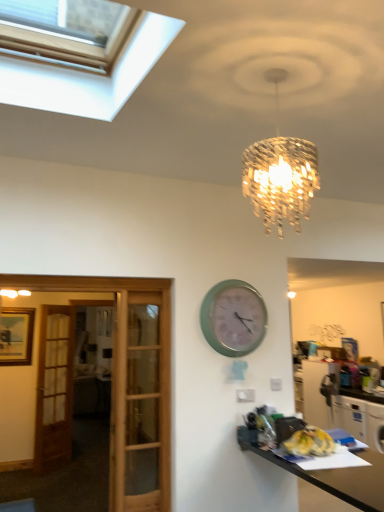
What is the approximate height of brown wooden door at left?

The height of brown wooden door at left is 1.86 meters.

Measure the distance between white glossy cabinet at lower right and camera.

They are 5.34 meters apart.

Locate an element on the screen. The width and height of the screenshot is (384, 512). green matte wall clock at center is located at coordinates [233, 318].

Where is `brown wooden door at left`? brown wooden door at left is located at coordinates (54, 388).

From the image's perspective, is brown wooden door at left over black glossy desk at lower right?

Incorrect, from the image's perspective, brown wooden door at left is lower than black glossy desk at lower right.

Considering the points (65, 454) and (354, 484), which point is in front, point (65, 454) or point (354, 484)?

The point (354, 484) is closer.

Relative to black glossy desk at lower right, is brown wooden door at left in front or behind?

Clearly, brown wooden door at left is behind black glossy desk at lower right.

From a real-world perspective, who is located higher, brown wooden door at left or black glossy desk at lower right?

brown wooden door at left, from a real-world perspective.

Is green matte wall clock at center spatially inside white glossy cabinet at lower right, or outside of it?

green matte wall clock at center is not inside white glossy cabinet at lower right, it's outside.

Is green matte wall clock at center positioned with its back to white glossy cabinet at lower right?

No, green matte wall clock at center is not facing away from white glossy cabinet at lower right.

Is green matte wall clock at center taller than white glossy cabinet at lower right?

In fact, green matte wall clock at center may be shorter than white glossy cabinet at lower right.

Is green matte wall clock at center bigger or smaller than white glossy cabinet at lower right?

Considering their sizes, green matte wall clock at center takes up less space than white glossy cabinet at lower right.

Does point (348, 429) appear closer or farther from the camera than point (350, 493)?

Point (348, 429) is positioned farther from the camera compared to point (350, 493).

How far apart are white glossy cabinet at lower right and black glossy desk at lower right?

3.54 meters.

How many degrees apart are the facing directions of white glossy cabinet at lower right and black glossy desk at lower right?

They differ by 3.05 degrees in their facing directions.

Considering the sizes of objects white glossy cabinet at lower right and black glossy desk at lower right in the image provided, who is smaller, white glossy cabinet at lower right or black glossy desk at lower right?

white glossy cabinet at lower right is smaller.

Is black glossy desk at lower right oriented away from white glossy cabinet at lower right?

That's not correct — black glossy desk at lower right is not looking away from white glossy cabinet at lower right.

From a real-world perspective, is black glossy desk at lower right over white glossy cabinet at lower right?

Incorrect, from a real-world perspective, black glossy desk at lower right is lower than white glossy cabinet at lower right.

Which object is positioned more to the right, black glossy desk at lower right or white glossy cabinet at lower right?

white glossy cabinet at lower right is more to the right.

Is there a large distance between black glossy desk at lower right and white glossy cabinet at lower right?

Yes, black glossy desk at lower right and white glossy cabinet at lower right are located far from each other.

Could you tell me if green matte wall clock at center is turned towards brown wooden door at left?

No, green matte wall clock at center is not oriented towards brown wooden door at left.

Measure the distance from green matte wall clock at center to brown wooden door at left.

green matte wall clock at center is 8.26 feet away from brown wooden door at left.

Would you consider green matte wall clock at center to be distant from brown wooden door at left?

Yes, green matte wall clock at center is far from brown wooden door at left.

Which is behind, point (241, 330) or point (63, 322)?

The point (63, 322) is more distant.

Is black glossy desk at lower right positioned beyond the bounds of brown wooden door at left?

Yes.

Can you confirm if black glossy desk at lower right is taller than brown wooden door at left?

No, black glossy desk at lower right is not taller than brown wooden door at left.

Does point (304, 475) come farther from viewer compared to point (62, 447)?

No, (304, 475) is in front of (62, 447).

Is black glossy desk at lower right aimed at brown wooden door at left?

No.

Which is less distant, (331, 475) or (259, 343)?

The point (331, 475) is in front.

Considering the relative positions of black glossy desk at lower right and green matte wall clock at center in the image provided, is black glossy desk at lower right to the left or to the right of green matte wall clock at center?

In the image, black glossy desk at lower right appears on the right side of green matte wall clock at center.

Is green matte wall clock at center located within black glossy desk at lower right?

Definitely not — green matte wall clock at center is not inside black glossy desk at lower right.

Is the surface of black glossy desk at lower right in direct contact with green matte wall clock at center?

A: No, black glossy desk at lower right is not with green matte wall clock at center.

You are a GUI agent. You are given a task and a screenshot of the screen. Output one action in this format:
    pyautogui.click(x=<x>, y=<y>)
    Task: Click on the door behind the black glossy desk at lower right
    
    Given the screenshot: What is the action you would take?
    pyautogui.click(x=54, y=388)

At what (x,y) coordinates should I click in order to perform the action: click on cabinetry that appears below the green matte wall clock at center (from a real-world perspective). Please return your answer as a coordinate pair (x, y). Image resolution: width=384 pixels, height=512 pixels. Looking at the image, I should click on (340, 406).

From the image, which object appears to be nearer to black glossy desk at lower right, brown wooden door at left or green matte wall clock at center?

Based on the image, green matte wall clock at center appears to be nearer to black glossy desk at lower right.

Looking at the image, which one is located further to green matte wall clock at center, brown wooden door at left or black glossy desk at lower right?

Among the two, brown wooden door at left is located further to green matte wall clock at center.

Which object lies further to the anchor point black glossy desk at lower right, green matte wall clock at center or brown wooden door at left?

brown wooden door at left.

Based on their spatial positions, is brown wooden door at left or black glossy desk at lower right further from white glossy cabinet at lower right?

brown wooden door at left lies further to white glossy cabinet at lower right than the other object.

Estimate the real-world distances between objects in this image. Which object is further from green matte wall clock at center, black glossy desk at lower right or white glossy cabinet at lower right?

white glossy cabinet at lower right is positioned further to the anchor green matte wall clock at center.

Estimate the real-world distances between objects in this image. Which object is closer to black glossy desk at lower right, white glossy cabinet at lower right or brown wooden door at left?

Among the two, brown wooden door at left is located nearer to black glossy desk at lower right.

Estimate the real-world distances between objects in this image. Which object is closer to green matte wall clock at center, black glossy desk at lower right or brown wooden door at left?

black glossy desk at lower right.

When comparing their distances from white glossy cabinet at lower right, does brown wooden door at left or green matte wall clock at center seem further?

brown wooden door at left is positioned further to the anchor white glossy cabinet at lower right.

Where is `wall clock between black glossy desk at lower right and white glossy cabinet at lower right along the z-axis`? This screenshot has height=512, width=384. wall clock between black glossy desk at lower right and white glossy cabinet at lower right along the z-axis is located at coordinates (233, 318).

The image size is (384, 512). In order to click on wall clock between brown wooden door at left and white glossy cabinet at lower right in this screenshot , I will do `click(233, 318)`.

Where is `wall clock between black glossy desk at lower right and brown wooden door at left along the z-axis`? The image size is (384, 512). wall clock between black glossy desk at lower right and brown wooden door at left along the z-axis is located at coordinates (233, 318).

Locate an element on the screen. The height and width of the screenshot is (512, 384). door positioned between black glossy desk at lower right and white glossy cabinet at lower right from near to far is located at coordinates (54, 388).